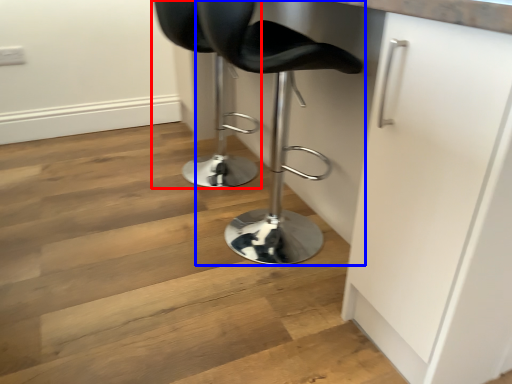
Question: Among these objects, which one is nearest to the camera, chair (highlighted by a red box) or chair (highlighted by a blue box)?

Choices:
 (A) chair
 (B) chair

Answer: (B)